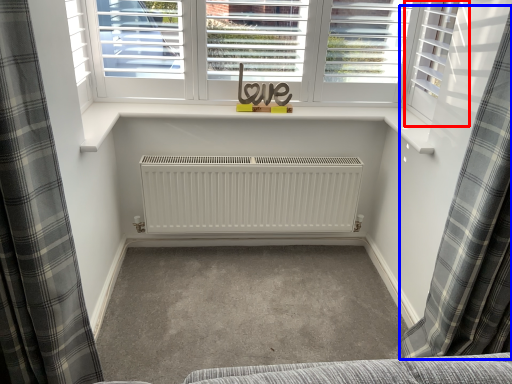
Question: Which of the following is the closest to the observer, shutter (highlighted by a red box) or curtain (highlighted by a blue box)?

Choices:
 (A) shutter
 (B) curtain

Answer: (B)